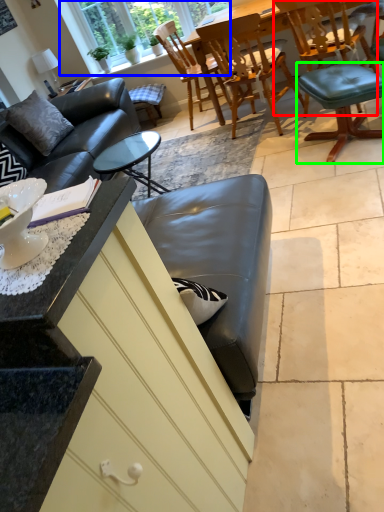
Question: Based on their relative distances, which object is nearer to chair (highlighted by a red box)? Choose from window (highlighted by a blue box) and bar stool (highlighted by a green box).

Choices:
 (A) window
 (B) bar stool

Answer: (B)